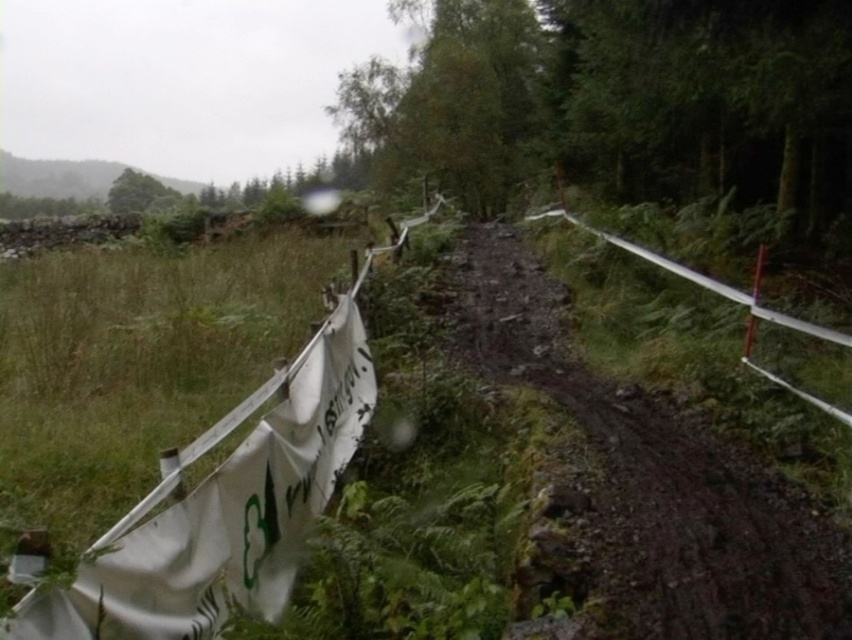
You are a hiker carrying a large backpack and need to cross the dull brown dirt track at center. There is also a white fabric banner at left nearby. Which object takes up more space in the image?

The dull brown dirt track at center takes up more space in the image because it is bigger than the white fabric banner at left.